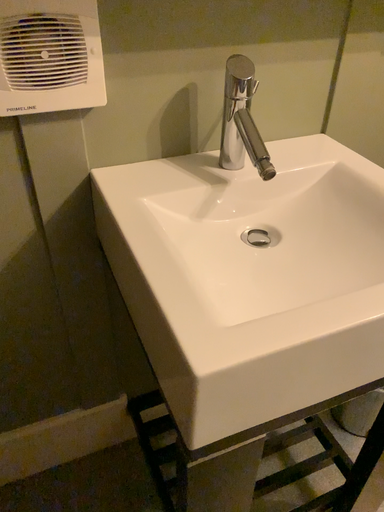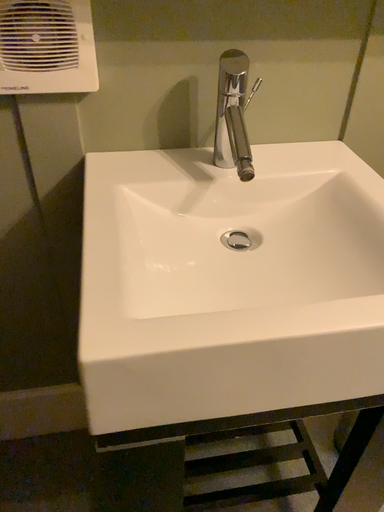
Question: How did the camera likely rotate when shooting the video?

Choices:
 (A) rotated right
 (B) rotated left

Answer: (B)